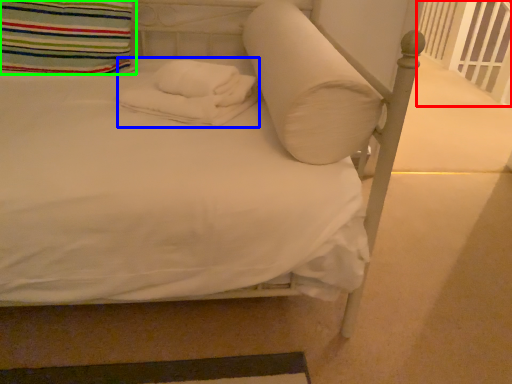
Question: Which object is positioned closest to balustrade (highlighted by a red box)? Select from material (highlighted by a blue box) and pillow (highlighted by a green box).

Choices:
 (A) material
 (B) pillow

Answer: (A)